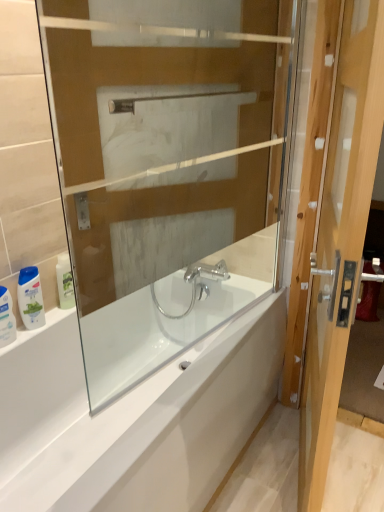
Question: Can you see transparent glass bathtub at center touching white glossy shampoo bottle at lower left, the second toiletry viewed from the left?

Choices:
 (A) no
 (B) yes

Answer: (A)

Question: Could you tell me if transparent glass bathtub at center is turned towards white glossy shampoo bottle at lower left, the second toiletry viewed from the left?

Choices:
 (A) no
 (B) yes

Answer: (A)

Question: Does transparent glass bathtub at center have a greater height compared to white glossy shampoo bottle at lower left, the second toiletry viewed from the left?

Choices:
 (A) no
 (B) yes

Answer: (B)

Question: Does transparent glass bathtub at center lie in front of white glossy shampoo bottle at lower left, which appears as the 2th toiletry when viewed from the right?

Choices:
 (A) yes
 (B) no

Answer: (A)

Question: From a real-world perspective, is transparent glass bathtub at center positioned over white glossy shampoo bottle at lower left, which appears as the 2th toiletry when viewed from the right, based on gravity?

Choices:
 (A) yes
 (B) no

Answer: (A)

Question: From the image's perspective, is transparent glass bathtub at center over white glossy shampoo bottle at lower left, the second toiletry viewed from the left?

Choices:
 (A) no
 (B) yes

Answer: (B)

Question: Can you confirm if light brown wooden door at right is shorter than white glossy shampoo bottle at lower left, the second toiletry viewed from the left?

Choices:
 (A) no
 (B) yes

Answer: (A)

Question: Are light brown wooden door at right and white glossy shampoo bottle at lower left, which appears as the 2th toiletry when viewed from the right, located far from each other?

Choices:
 (A) no
 (B) yes

Answer: (B)

Question: Considering the relative positions of light brown wooden door at right and white glossy shampoo bottle at lower left, the second toiletry viewed from the left, in the image provided, is light brown wooden door at right to the left of white glossy shampoo bottle at lower left, the second toiletry viewed from the left, from the viewer's perspective?

Choices:
 (A) no
 (B) yes

Answer: (A)

Question: Is light brown wooden door at right bigger than white glossy shampoo bottle at lower left, the second toiletry viewed from the left?

Choices:
 (A) yes
 (B) no

Answer: (A)

Question: Is the depth of light brown wooden door at right less than that of white glossy shampoo bottle at lower left, which appears as the 2th toiletry when viewed from the right?

Choices:
 (A) yes
 (B) no

Answer: (A)

Question: From the image's perspective, is light brown wooden door at right located beneath white glossy shampoo bottle at lower left, which appears as the 2th toiletry when viewed from the right?

Choices:
 (A) no
 (B) yes

Answer: (A)

Question: Is white glossy shampoo bottle at lower left, which appears as the 2th toiletry when viewed from the right, positioned with its back to white glossy bottle at left, arranged as the first toiletry when viewed from the right?

Choices:
 (A) no
 (B) yes

Answer: (A)